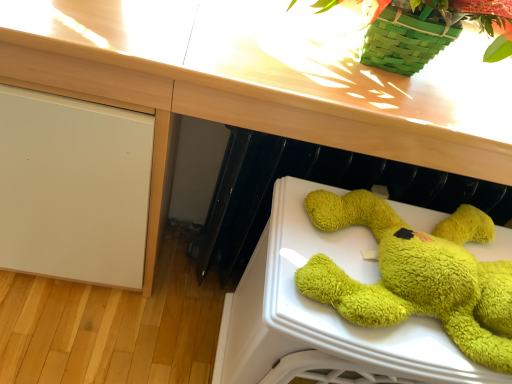
This screenshot has height=384, width=512. Find the location of `vacant space underneath green fuzzy stuffed animal at lower right (from a real-world perspective)`. vacant space underneath green fuzzy stuffed animal at lower right (from a real-world perspective) is located at coordinates (388, 274).